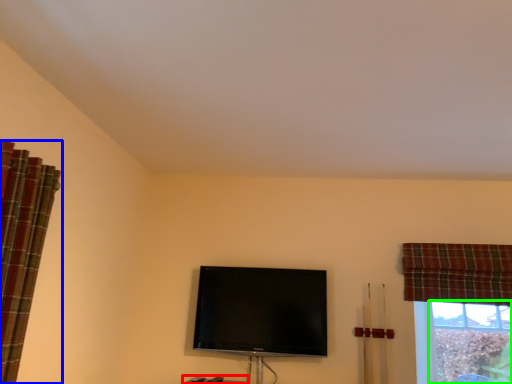
Question: Based on their relative distances, which object is farther from furniture (highlighted by a red box)? Choose from curtain (highlighted by a blue box) and bay window (highlighted by a green box).

Choices:
 (A) curtain
 (B) bay window

Answer: (B)